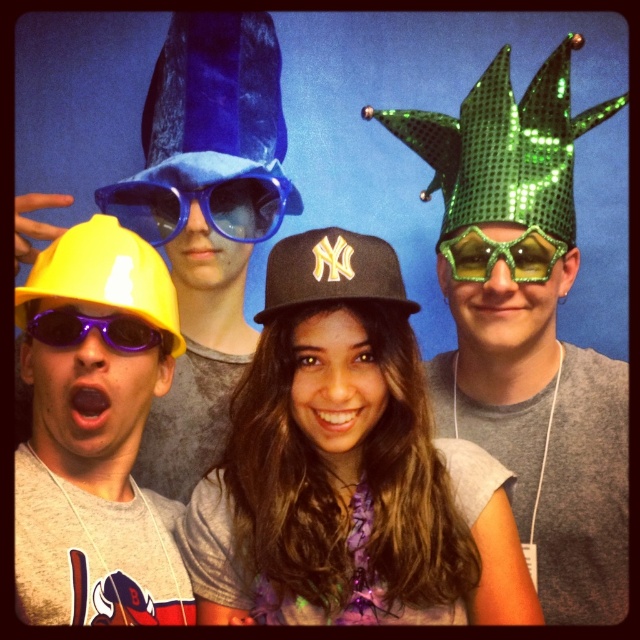
You are a photographer trying to adjust the lighting for the photo. You notice the blue velvet baseball hat at upper left and the purple plastic sunglasses at lower left. Which accessory is positioned higher in the image?

The blue velvet baseball hat at upper left is located above the purple plastic sunglasses at lower left, so it is positioned higher in the image.

You are standing in front of the group photo. You need to place a sticker on the yellow matte baseball cap at left and the black matte baseball cap at center. Which cap should you place the sticker on first if you want to start from the left side of the photo?

You should place the sticker on the yellow matte baseball cap at left first because it is positioned to the left of the black matte baseball cap at center.

You are a photographer trying to adjust the lighting for a group photo. You notice two headpieces in the image. Which headpiece, the green sequined crown at center or the black matte baseball cap at center, requires more upward adjustment of the light to avoid shadows on the faces below it?

The green sequined crown at center is taller than the black matte baseball cap at center, so it requires more upward adjustment of the light to avoid shadows on the faces below it.